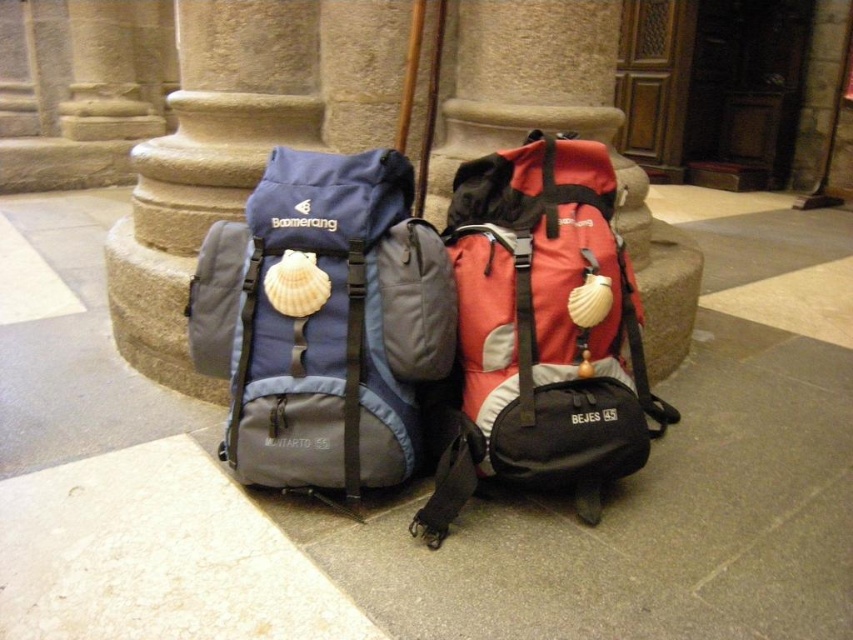
Is gray stone pavement at center below matte red backpack at center?

No.

Is gray stone pavement at center positioned in front of matte red backpack at center?

Yes.

Does point (67, 476) come in front of point (483, 461)?

No, (67, 476) is behind (483, 461).

Locate an element on the screen. The width and height of the screenshot is (853, 640). gray stone pavement at center is located at coordinates click(x=421, y=492).